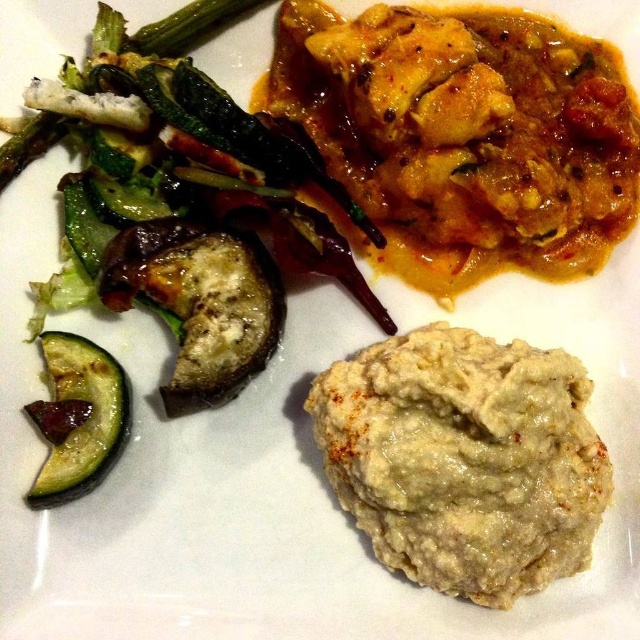
What is the position of the white creamy paste at center relative to the saut?ed vegetables in the upper left?

The white creamy paste at center is located to the right of the saut?ed vegetables in the upper left.

You are a food critic evaluating this meal. You notice the white creamy paste at center and the green matte cucumber at lower left. Which of these two items is positioned closer to you on the plate?

The white creamy paste at center is closer to the viewer than the green matte cucumber at lower left.

You are a food critic analyzing the arrangement of this meal. Based on the description, which object is placed below the other between the white creamy paste at center and the green matte cucumber at lower left?

The white creamy paste at center is positioned under the green matte cucumber at lower left, meaning the green matte cucumber at lower left is placed above it.